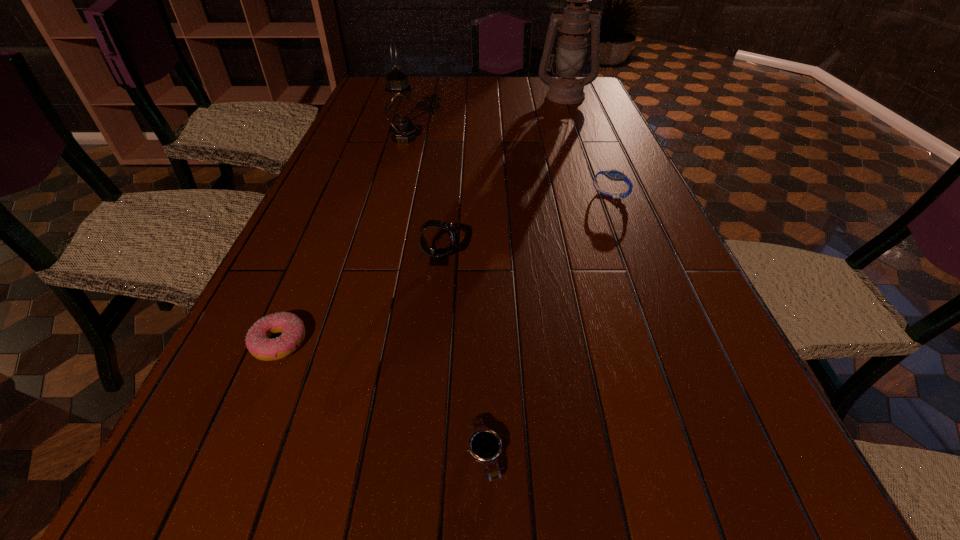
Identify the location of free spot between the fifth tallest object and the second watch from left to right. click(382, 399).

Where is `unoccupied area between the shortest watch and the fourth tallest object`? unoccupied area between the shortest watch and the fourth tallest object is located at coordinates (547, 325).

The width and height of the screenshot is (960, 540). I want to click on vacant region between the leftmost watch and the second shortest watch, so click(525, 227).

At what (x,y) coordinates should I click in order to perform the action: click on free space between the farther oil lamp and the fourth object from left to right. Please return your answer as a coordinate pair (x, y). The width and height of the screenshot is (960, 540). Looking at the image, I should click on (525, 276).

Where is `empty space between the second shortest watch and the third object from right to left`? empty space between the second shortest watch and the third object from right to left is located at coordinates (547, 325).

I want to click on vacant space in between the fifth farthest object and the right oil lamp, so click(x=422, y=219).

Choose which object is the fourth nearest neighbor to the fifth nearest object. Please provide its 2D coordinates. Your answer should be formatted as a tuple, i.e. [(x, y)], where the tuple contains the x and y coordinates of a point satisfying the conditions above.

[(258, 342)]

The width and height of the screenshot is (960, 540). What are the coordinates of `object that ranks as the second closest to the fourth nearest object` in the screenshot? It's located at (400, 112).

Where is `watch that is the third closest to the farther oil lamp`? This screenshot has height=540, width=960. watch that is the third closest to the farther oil lamp is located at coordinates (485, 445).

At what (x,y) coordinates should I click in order to perform the action: click on watch that is the closest one to the third nearest object. Please return your answer as a coordinate pair (x, y). Looking at the image, I should click on (485, 445).